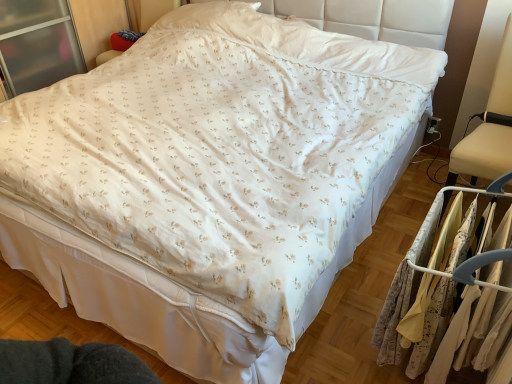
Question: Is beige fabric swivel chair at right looking in the opposite direction of floral fabric dress at right?

Choices:
 (A) yes
 (B) no

Answer: (B)

Question: Does beige fabric swivel chair at right have a greater width compared to floral fabric dress at right?

Choices:
 (A) no
 (B) yes

Answer: (B)

Question: Does beige fabric swivel chair at right have a lesser height compared to floral fabric dress at right?

Choices:
 (A) yes
 (B) no

Answer: (B)

Question: Can you confirm if beige fabric swivel chair at right is positioned to the right of floral fabric dress at right?

Choices:
 (A) no
 (B) yes

Answer: (B)

Question: Are beige fabric swivel chair at right and floral fabric dress at right located far from each other?

Choices:
 (A) yes
 (B) no

Answer: (B)

Question: Considering the relative positions of beige fabric swivel chair at right and floral fabric dress at right in the image provided, is beige fabric swivel chair at right to the left of floral fabric dress at right from the viewer's perspective?

Choices:
 (A) yes
 (B) no

Answer: (B)

Question: Is floral fabric dress at right positioned far away from silky beige fabric at right?

Choices:
 (A) yes
 (B) no

Answer: (B)

Question: From the image's perspective, is floral fabric dress at right beneath silky beige fabric at right?

Choices:
 (A) no
 (B) yes

Answer: (B)

Question: Is floral fabric dress at right bigger than silky beige fabric at right?

Choices:
 (A) yes
 (B) no

Answer: (B)

Question: Is the depth of floral fabric dress at right greater than that of silky beige fabric at right?

Choices:
 (A) no
 (B) yes

Answer: (B)

Question: Is floral fabric dress at right oriented towards silky beige fabric at right?

Choices:
 (A) yes
 (B) no

Answer: (A)

Question: Is floral fabric dress at right not within silky beige fabric at right?

Choices:
 (A) yes
 (B) no

Answer: (B)

Question: Is silky beige fabric at right directly adjacent to floral fabric dress at right?

Choices:
 (A) no
 (B) yes

Answer: (B)